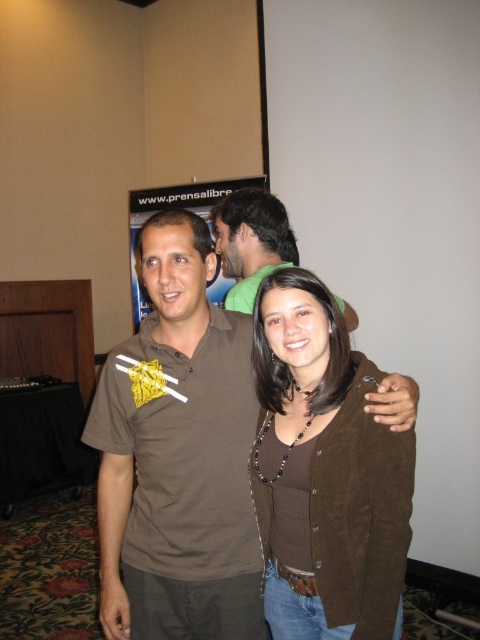
Is brown suede shirt at center to the right of brown cotton shirt at center from the viewer's perspective?

In fact, brown suede shirt at center is to the left of brown cotton shirt at center.

Describe the element at coordinates (178, 454) in the screenshot. This screenshot has width=480, height=640. I see `brown suede shirt at center` at that location.

Locate an element on the screen. The height and width of the screenshot is (640, 480). brown suede shirt at center is located at coordinates (178, 454).

The image size is (480, 640). Identify the location of brown suede shirt at center. (178, 454).

Which of these two, brown suede shirt at center or brown suede cardigan at center, stands taller?

brown suede shirt at center

Can you confirm if brown suede shirt at center is bigger than brown suede cardigan at center?

Yes.

Which is behind, point (109, 508) or point (350, 416)?

The point (109, 508) is more distant.

Find the location of `brown suede shirt at center`. brown suede shirt at center is located at coordinates (178, 454).

Between brown suede cardigan at center and brown cotton shirt at center, which one appears on the right side from the viewer's perspective?

brown suede cardigan at center is more to the right.

Is point (279, 312) closer to camera compared to point (242, 266)?

That is True.

In order to click on brown suede cardigan at center in this screenshot , I will do `click(325, 467)`.